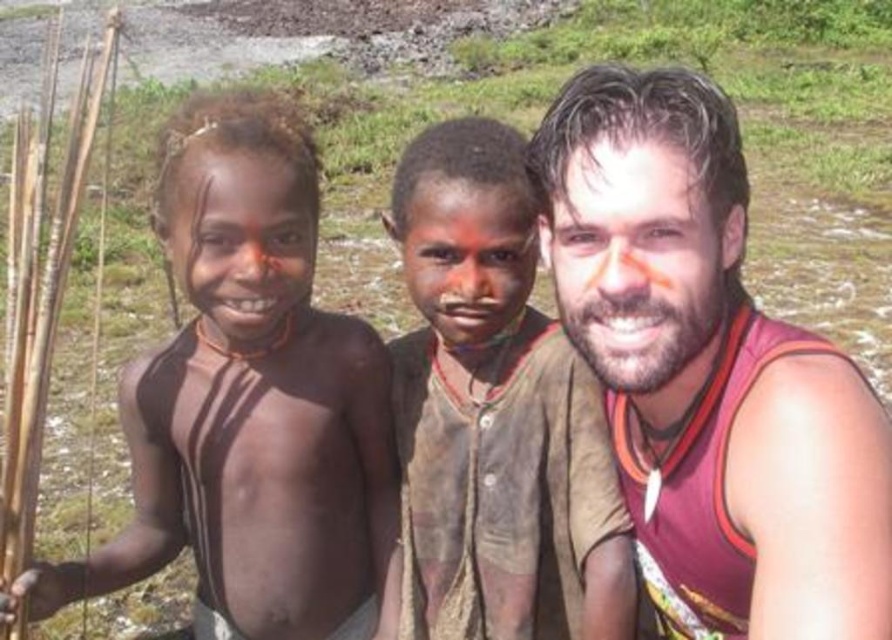
Does brown matte skin at left have a lesser height compared to brown mud face at center?

No.

Does brown matte skin at left have a larger size compared to brown mud face at center?

Yes.

Which is in front, point (233, 371) or point (601, 596)?

Point (601, 596)

Locate an element on the screen. This screenshot has width=892, height=640. brown matte skin at left is located at coordinates (252, 404).

Can you confirm if matte red tank top at right is wider than brown matte skin at left?

No, matte red tank top at right is not wider than brown matte skin at left.

Who is shorter, matte red tank top at right or brown matte skin at left?

matte red tank top at right is shorter.

Identify the location of matte red tank top at right. (709, 372).

Where is `matte red tank top at right`? matte red tank top at right is located at coordinates (709, 372).

Does matte red tank top at right lie behind brown mud face at center?

No, it is not.

Is matte red tank top at right to the right of brown mud face at center from the viewer's perspective?

Yes, matte red tank top at right is to the right of brown mud face at center.

Find the location of a particular element. The image size is (892, 640). matte red tank top at right is located at coordinates (709, 372).